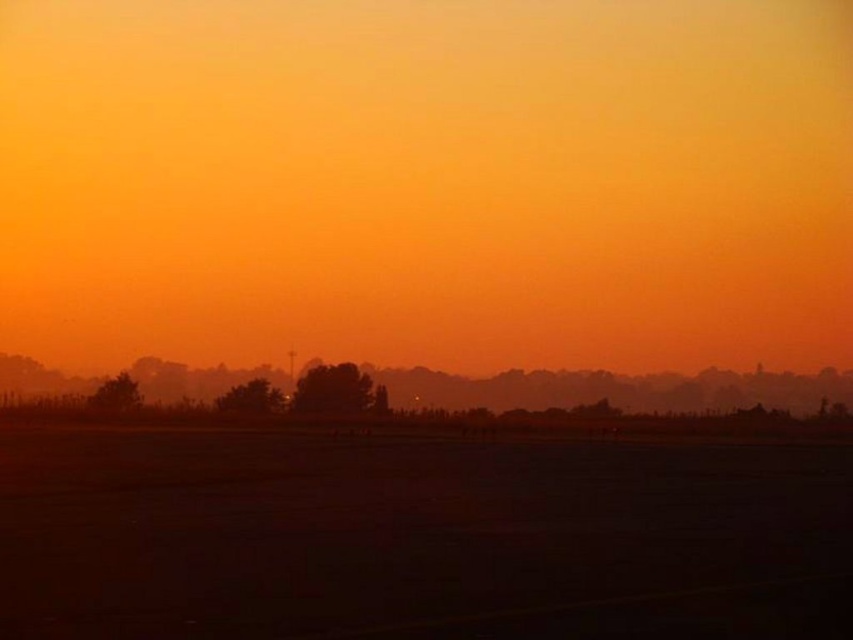
Question: Among these objects, which one is farthest from the camera?

Choices:
 (A) dark matte tarmac at center
 (B) foggy horizon at center

Answer: (B)

Question: Which point is farther to the camera?

Choices:
 (A) foggy horizon at center
 (B) dark matte tarmac at center

Answer: (A)

Question: Which object is closer to the camera taking this photo?

Choices:
 (A) foggy horizon at center
 (B) dark matte tarmac at center

Answer: (B)

Question: Can you confirm if dark matte tarmac at center is thinner than foggy horizon at center?

Choices:
 (A) yes
 (B) no

Answer: (A)

Question: From the image, what is the correct spatial relationship of dark matte tarmac at center in relation to foggy horizon at center?

Choices:
 (A) right
 (B) left

Answer: (B)

Question: Does dark matte tarmac at center have a greater width compared to foggy horizon at center?

Choices:
 (A) no
 (B) yes

Answer: (A)